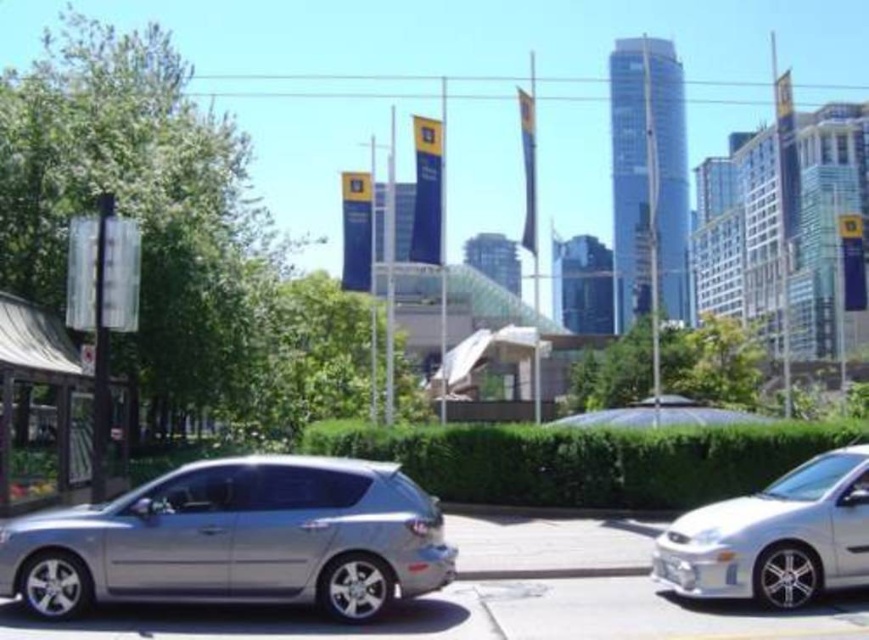
You are standing in the urban scene and want to determine the relative positions of two points marked in the image. Which of the two points, point 1 at coordinates point (335,493) or point 2 at coordinates point (735,493), is closer to your viewpoint?

Point 1 at coordinates point (335,493) is closer to the camera than point 2 at coordinates point (735,493).

You are a delivery person trying to determine if your 2.5 meter tall package can be transported through the space between the green leafy hedge at center and the satin white sedan at right. Can it fit vertically?

The green leafy hedge at center is taller than the satin white sedan at right, but the exact height difference isn

You are standing at the camera position and want to reach the point at coordinates point (602, 497). Is this point within a safe distance for a person to walk to?

The point at coordinates point (602, 497) is 19.22 meters away from the camera, which is a safe distance for a person to walk to.